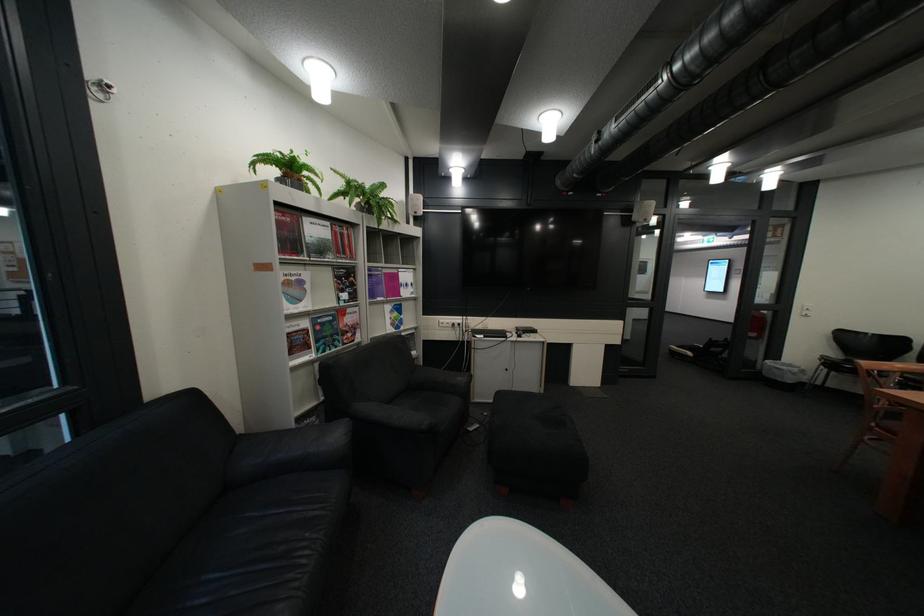
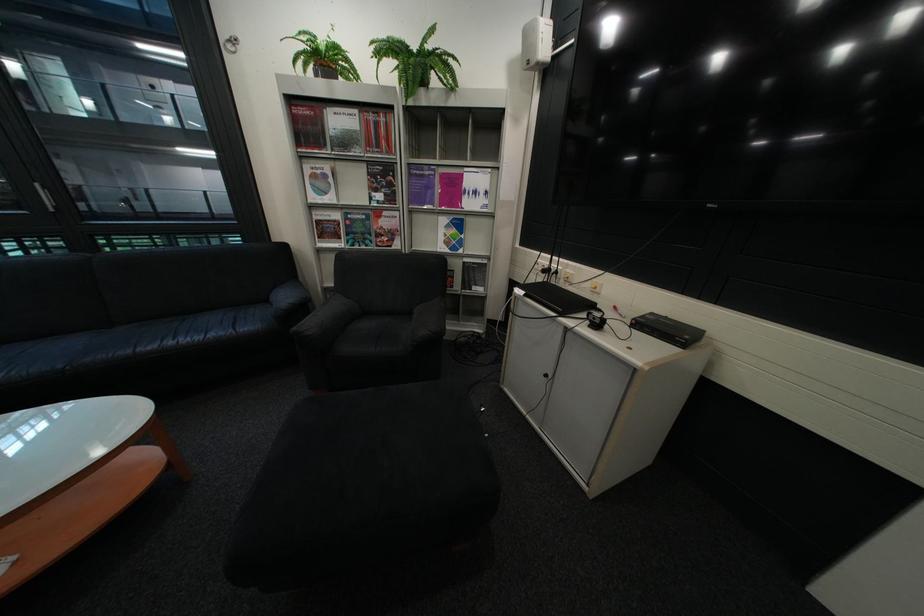
The point at (496,336) is marked in the first image. Where is the corresponding point in the second image?

(538, 293)